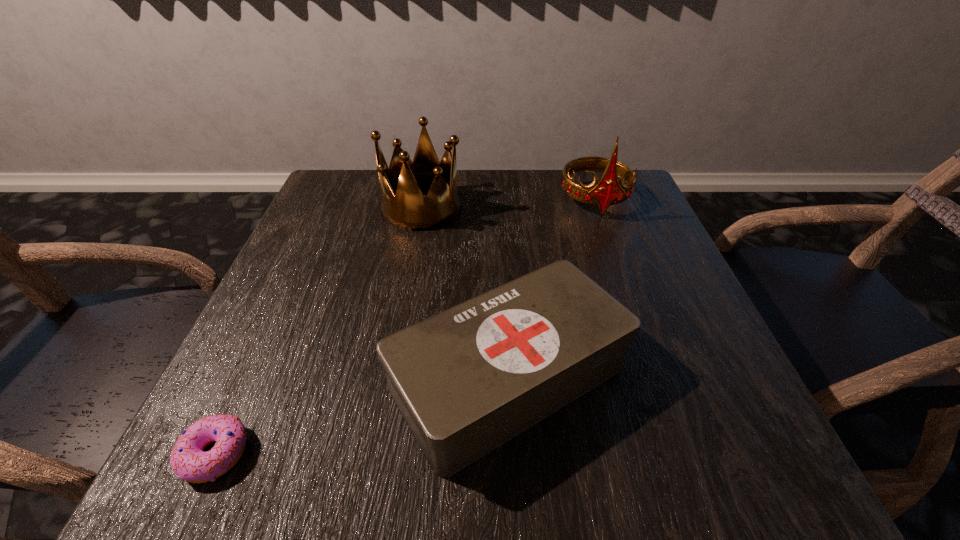
Find the location of a particular element. The image size is (960, 540). vacant space in between the doughnut and the crown is located at coordinates (319, 330).

The height and width of the screenshot is (540, 960). Find the location of `vacant area that lies between the leftmost object and the first-aid kit`. vacant area that lies between the leftmost object and the first-aid kit is located at coordinates (362, 416).

Locate an element on the screen. The image size is (960, 540). vacant area that lies between the doughnut and the first-aid kit is located at coordinates (362, 416).

You are a GUI agent. You are given a task and a screenshot of the screen. Output one action in this format:
    pyautogui.click(x=<x>, y=<y>)
    Task: Click on the object that is the third closest one to the tiara
    The width and height of the screenshot is (960, 540).
    Given the screenshot: What is the action you would take?
    pyautogui.click(x=188, y=461)

Select which object appears as the second closest to the shortest object. Please provide its 2D coordinates. Your answer should be formatted as a tuple, i.e. [(x, y)], where the tuple contains the x and y coordinates of a point satisfying the conditions above.

[(401, 204)]